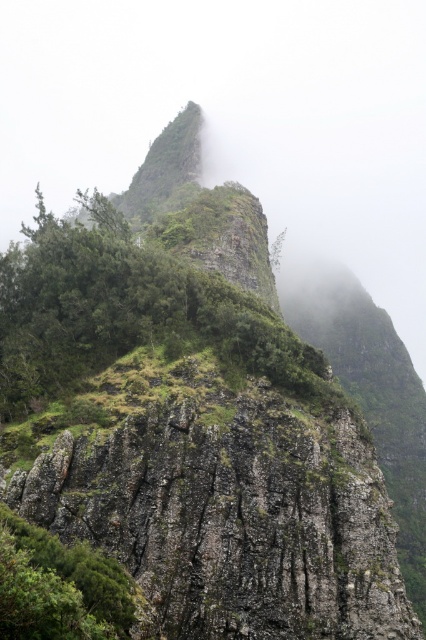
Question: Which point appears closest to the camera in this image?

Choices:
 (A) (123, 627)
 (B) (258, 349)

Answer: (A)

Question: Observing the image, what is the correct spatial positioning of green leafy shrubs at center in reference to green leafy shrub at lower left?

Choices:
 (A) below
 (B) above

Answer: (B)

Question: Does green leafy shrubs at center have a larger size compared to green leafy shrub at lower left?

Choices:
 (A) yes
 (B) no

Answer: (A)

Question: Which point is farther to the camera?

Choices:
 (A) green leafy shrubs at center
 (B) green leafy shrub at lower left

Answer: (A)

Question: Considering the relative positions of green leafy shrubs at center and green leafy shrub at lower left in the image provided, where is green leafy shrubs at center located with respect to green leafy shrub at lower left?

Choices:
 (A) below
 (B) above

Answer: (B)